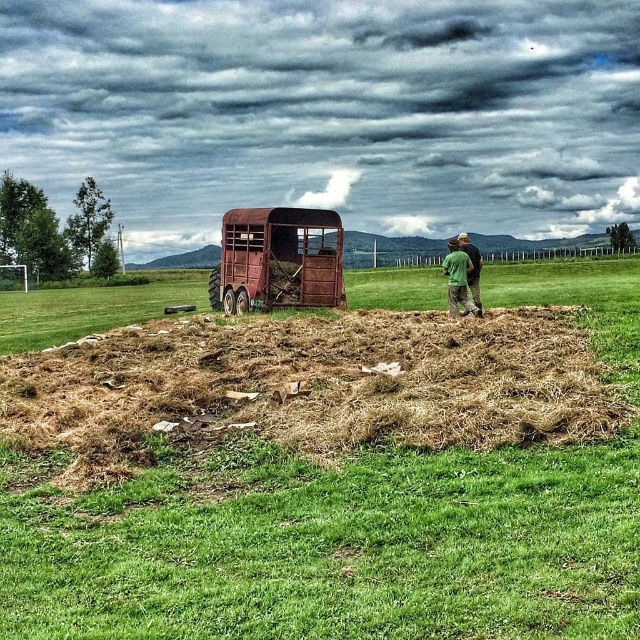
Does brown dry grass at center lie behind green cotton shirt at right?

That is False.

Can you confirm if brown dry grass at center is shorter than green cotton shirt at right?

Yes.

Identify the location of brown dry grass at center. (332, 545).

Which is in front, point (512, 433) or point (468, 275)?

Positioned in front is point (512, 433).

Does brown dry hay at center appear over green cotton shirt at right?

No.

Describe the element at coordinates (310, 385) in the screenshot. The height and width of the screenshot is (640, 640). I see `brown dry hay at center` at that location.

Where is `brown dry hay at center`? This screenshot has width=640, height=640. brown dry hay at center is located at coordinates [x=310, y=385].

Which is above, green fabric shirt at upper right or green cotton shirt at right?

green cotton shirt at right

Can you confirm if green fabric shirt at upper right is positioned above green cotton shirt at right?

No.

Who is more distant from viewer, (465,304) or (474,289)?

The point (474,289) is more distant.

Locate an element on the screen. Image resolution: width=640 pixels, height=640 pixels. green fabric shirt at upper right is located at coordinates (458, 278).